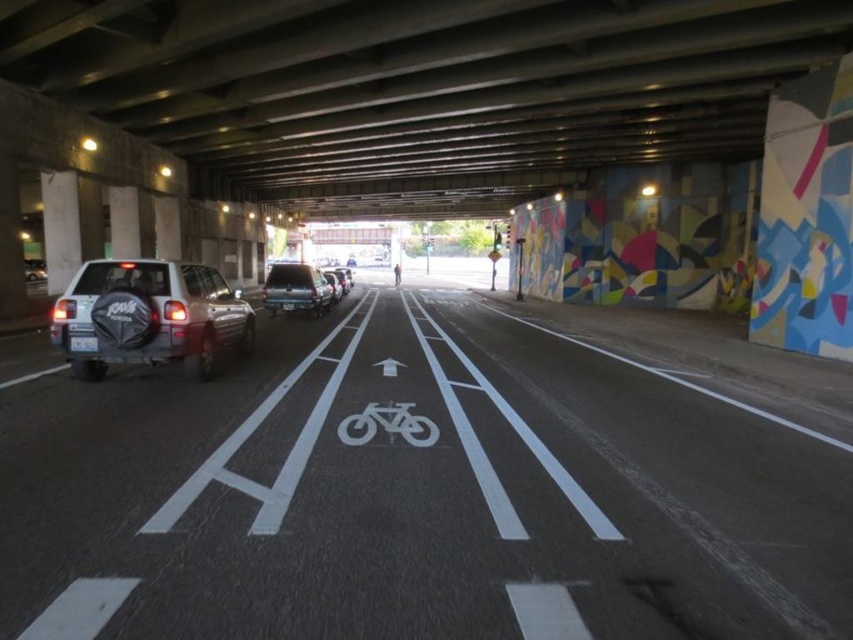
Question: Which object is the farthest from the satin silver suv at center?

Choices:
 (A) white plastic license plate at center
 (B) white painted lines at center

Answer: (B)

Question: Where is white painted lines at center located in relation to white plastic license plate at left in the image?

Choices:
 (A) left
 (B) right

Answer: (B)

Question: Which of the following is the farthest from the observer?

Choices:
 (A) white plastic license plate at center
 (B) satin silver suv at left

Answer: (A)

Question: Which of the following is the closest to the observer?

Choices:
 (A) white plastic license plate at center
 (B) satin silver suv at left
 (C) white plastic license plate at left

Answer: (B)

Question: Does white painted lines at center have a greater width compared to white plastic license plate at left?

Choices:
 (A) yes
 (B) no

Answer: (A)

Question: Does satin silver suv at left appear under satin silver suv at center?

Choices:
 (A) yes
 (B) no

Answer: (A)